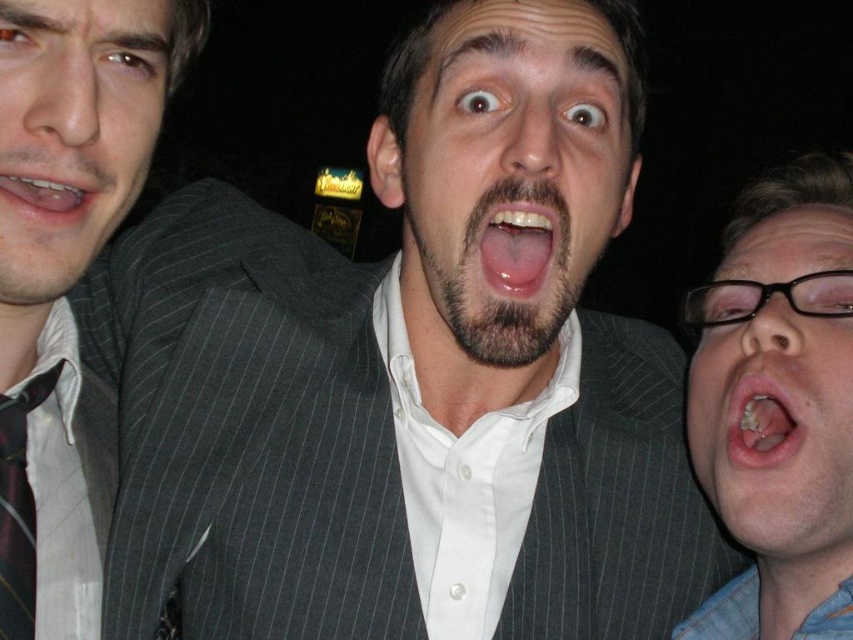
Based on the photo, you are a photographer standing 2 meters away from the pinstriped suit at center. You want to take a closeup shot of the matte black glasses at right without moving the subjects. Can you zoom in enough to capture the glasses clearly from your current position?

The distance between the pinstriped suit at center and matte black glasses at right is 1.01 meters. Since you are 2 meters away from the pinstriped suit at center, the matte black glasses at right would be approximately 3.01 meters away from you. Whether your camera can zoom sufficiently depends on its maximum focal length. If your camera has a telephoto lens capable of focusing at 3.01 meters or more, then yes, you can capture the matte black glasses at right clearly without moving the subjects.

Based on the scene description, if someone is looking at the image, which object would they see first between the matte gray suit at center and the matte black teeth at center?

The matte gray suit at center is located above the matte black teeth at center, so it would be seen first since it is positioned higher in the visual hierarchy.

From the picture: You are standing in front of a group photo of three people. The central figure is wearing a pinstriped suit jacket over a white shirt. There is a point at coordinates [514,170] in the image. Which person in the photo is wearing the matte gray suit located at that point?

The matte gray suit at center is located at point [514,170], so the central figure wearing the pinstriped suit jacket over a white shirt is the one at that point.